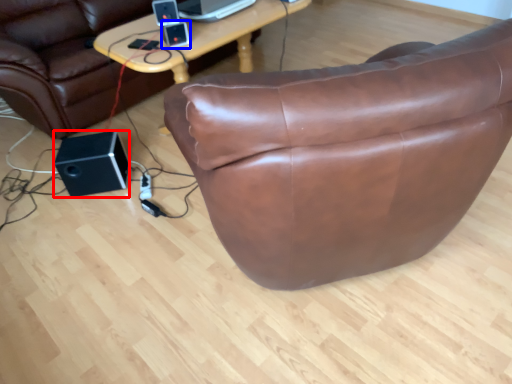
Question: Which point is closer to the camera, speaker (highlighted by a red box) or ipod (highlighted by a blue box)?

Choices:
 (A) speaker
 (B) ipod

Answer: (B)